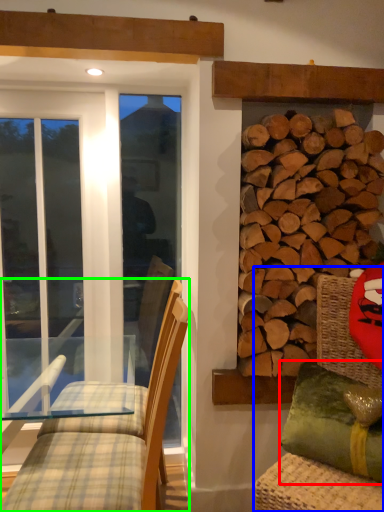
Question: Estimate the real-world distances between objects in this image. Which object is closer to pillow (highlighted by a red box), swivel chair (highlighted by a blue box) or chair (highlighted by a green box)?

Choices:
 (A) swivel chair
 (B) chair

Answer: (A)